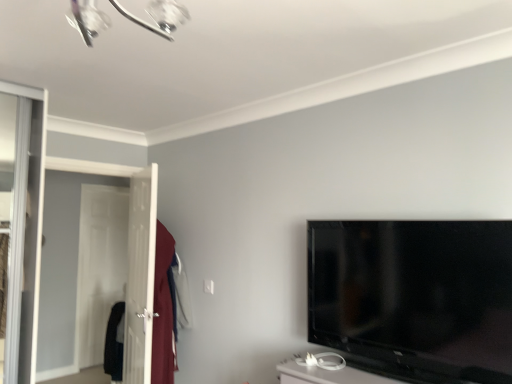
Question: Does white glossy screen door at left come in front of black glossy tv at right?

Choices:
 (A) yes
 (B) no

Answer: (B)

Question: Considering the relative sizes of white glossy screen door at left and black glossy tv at right in the image provided, is white glossy screen door at left smaller than black glossy tv at right?

Choices:
 (A) yes
 (B) no

Answer: (B)

Question: Are white glossy screen door at left and black glossy tv at right located far from each other?

Choices:
 (A) no
 (B) yes

Answer: (B)

Question: Is white glossy screen door at left to the right of black glossy tv at right from the viewer's perspective?

Choices:
 (A) no
 (B) yes

Answer: (A)

Question: From the image's perspective, does white glossy screen door at left appear higher than black glossy tv at right?

Choices:
 (A) yes
 (B) no

Answer: (B)

Question: Does white glossy screen door at left turn towards black glossy tv at right?

Choices:
 (A) no
 (B) yes

Answer: (A)

Question: Does black glossy tv at right turn towards white glossy screen door at left?

Choices:
 (A) no
 (B) yes

Answer: (A)

Question: Can you confirm if black glossy tv at right is positioned to the right of white glossy screen door at left?

Choices:
 (A) yes
 (B) no

Answer: (A)

Question: From the image's perspective, is black glossy tv at right beneath white glossy screen door at left?

Choices:
 (A) no
 (B) yes

Answer: (A)

Question: From a real-world perspective, is black glossy tv at right over white glossy screen door at left?

Choices:
 (A) yes
 (B) no

Answer: (A)

Question: Is black glossy tv at right smaller than white glossy screen door at left?

Choices:
 (A) yes
 (B) no

Answer: (A)

Question: Is black glossy tv at right shorter than white glossy screen door at left?

Choices:
 (A) yes
 (B) no

Answer: (A)

Question: Considering the positions of white glossy screen door at left and black glossy tv at right in the image, is white glossy screen door at left wider or thinner than black glossy tv at right?

Choices:
 (A) thin
 (B) wide

Answer: (B)